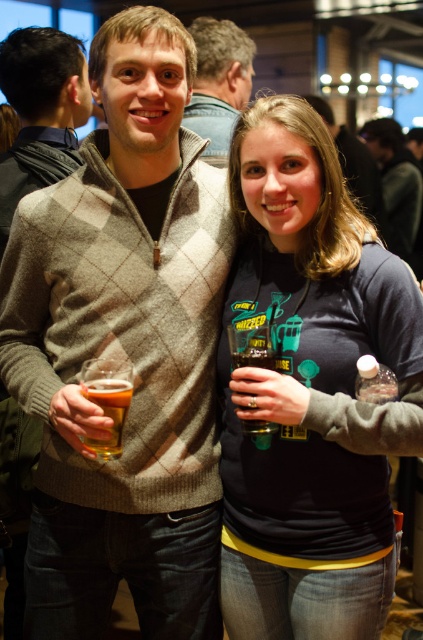
You are at a party and need to decide which item to take with you quickly. The dark gray sweatshirt at center and the clear plastic bottle at lower right are both within reach. Which one is easier to grab quickly?

The dark gray sweatshirt at center is bigger than the clear plastic bottle at lower right, so it is easier to grab quickly.

From the picture: You are at a social gathering and see two people. The person on the left is wearing a gray argyle sweater, and the person on the right is wearing a dark blue shirt with a graphic design. There is a point at coordinate [41,113]. Which object corresponds to the knit sweater at left?

The knit sweater at left is represented by the point at coordinate [41,113].